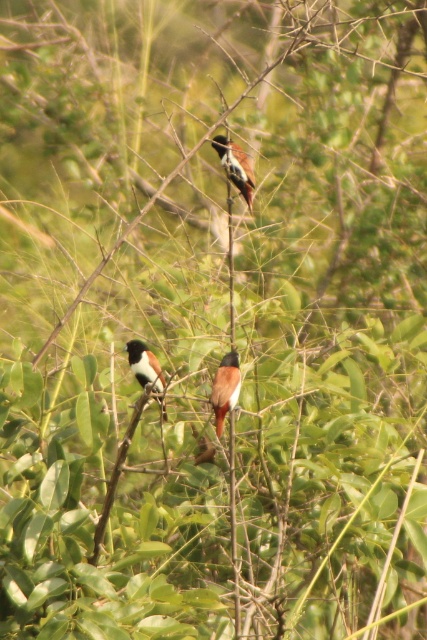
Question: Can you confirm if brown matte bird at center is thinner than brown glossy bird at center?

Choices:
 (A) yes
 (B) no

Answer: (A)

Question: Which object is farther from the camera taking this photo?

Choices:
 (A) brown glossy bird at center
 (B) brown matte bird at center

Answer: (A)

Question: Is brown matte bird at center positioned behind brown and white feathers at center?

Choices:
 (A) yes
 (B) no

Answer: (B)

Question: Which of the following is the farthest from the observer?

Choices:
 (A) (219, 136)
 (B) (222, 404)

Answer: (A)

Question: Which object is farther from the camera taking this photo?

Choices:
 (A) brown glossy bird at center
 (B) brown and white feathers at center

Answer: (A)

Question: Does brown matte bird at center appear on the right side of brown glossy bird at center?

Choices:
 (A) yes
 (B) no

Answer: (B)